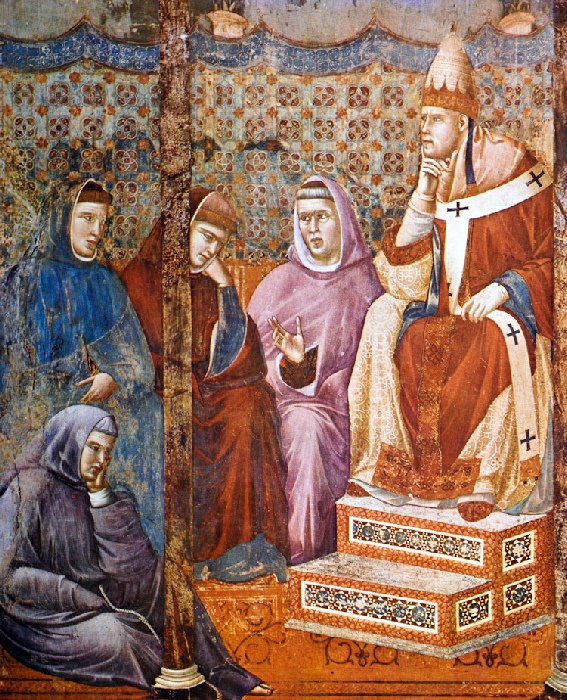
The image size is (567, 700). I want to click on curtain, so click(x=306, y=83), click(x=84, y=99).